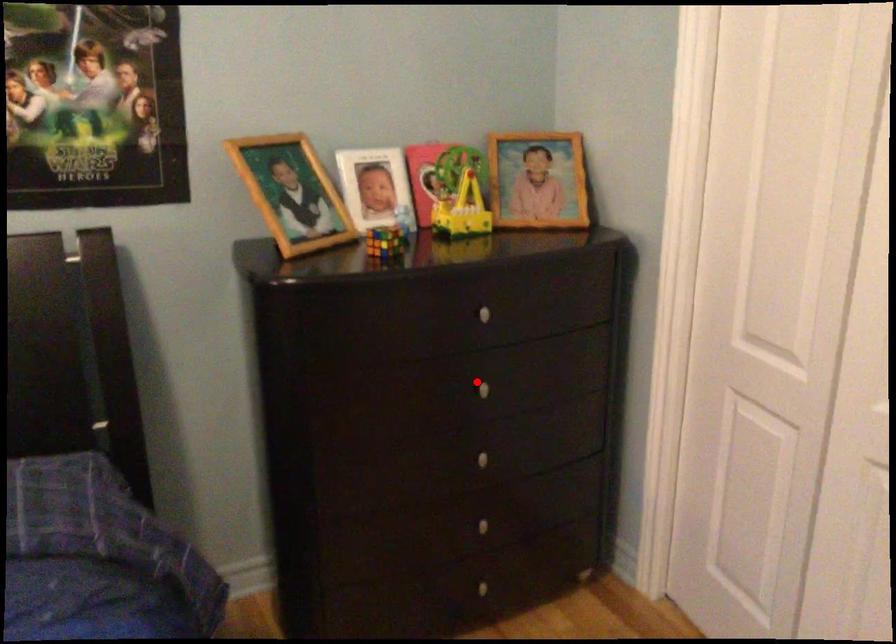
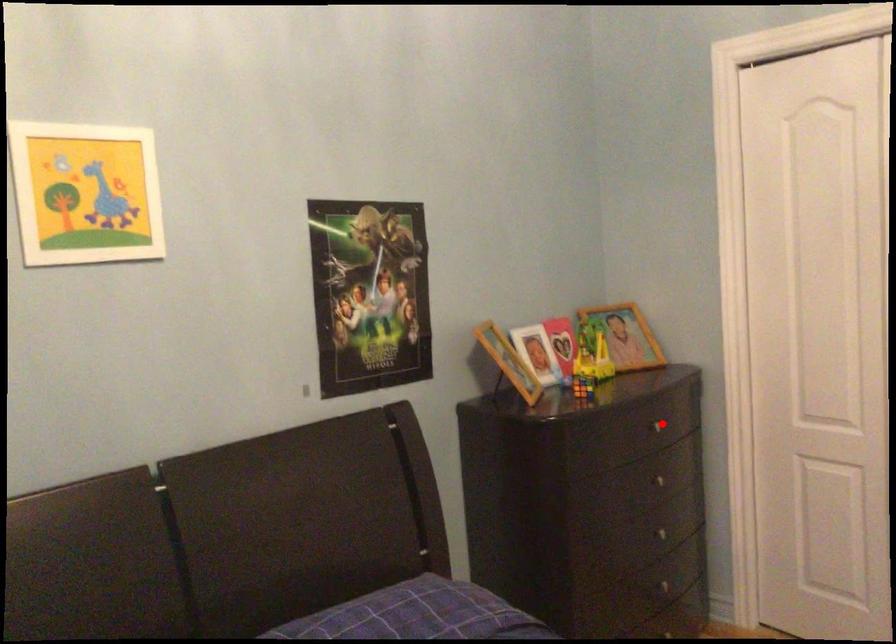
I am providing you with two images of the same scene from different viewpoints. A red point is marked on the first image and another point is marked on the second image. Does the point marked in image1 correspond to the same location as the one in image2?

No